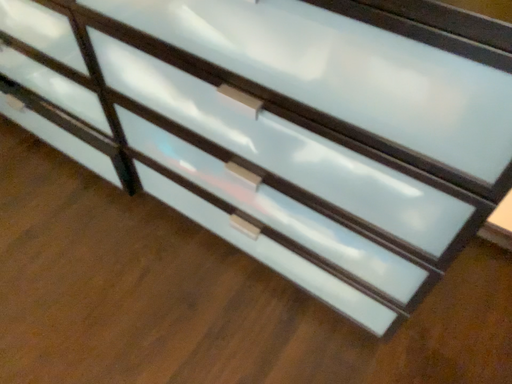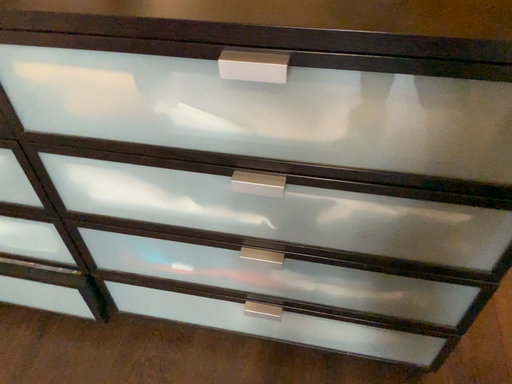
Question: Which way did the camera rotate in the video?

Choices:
 (A) rotated upward
 (B) rotated downward

Answer: (A)